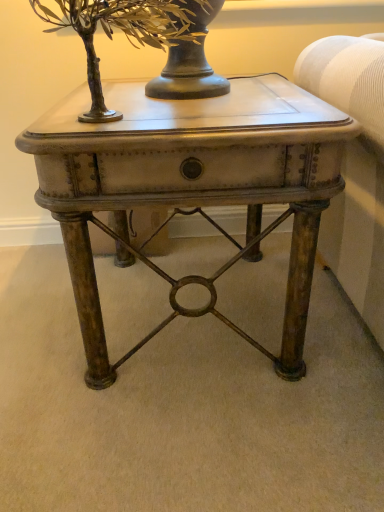
The width and height of the screenshot is (384, 512). In order to click on free area below green metallic tree at upper center (from a real-world perspective) in this screenshot , I will do `click(143, 109)`.